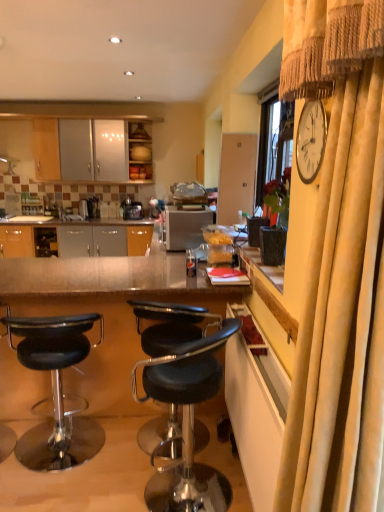
Question: Considering the relative sizes of velvet beige curtain at right and satin black coffee machine at center, placed as the 1th coffee machine when sorted from left to right, in the image provided, is velvet beige curtain at right thinner than satin black coffee machine at center, placed as the 1th coffee machine when sorted from left to right,?

Choices:
 (A) yes
 (B) no

Answer: (B)

Question: Does velvet beige curtain at right appear on the right side of satin black coffee machine at center, placed as the second coffee machine when sorted from right to left?

Choices:
 (A) yes
 (B) no

Answer: (A)

Question: Is velvet beige curtain at right located outside satin black coffee machine at center, placed as the 1th coffee machine when sorted from left to right?

Choices:
 (A) no
 (B) yes

Answer: (B)

Question: Is velvet beige curtain at right bigger than satin black coffee machine at center, placed as the 1th coffee machine when sorted from left to right?

Choices:
 (A) no
 (B) yes

Answer: (B)

Question: Is the depth of velvet beige curtain at right less than that of satin black coffee machine at center, placed as the second coffee machine when sorted from right to left?

Choices:
 (A) yes
 (B) no

Answer: (A)

Question: Looking at their shapes, would you say metallic/reflective table at center is wider or thinner than black leather stool at lower right, the 1th chair viewed from the right?

Choices:
 (A) wide
 (B) thin

Answer: (A)

Question: Is point (66, 259) positioned closer to the camera than point (201, 510)?

Choices:
 (A) farther
 (B) closer

Answer: (A)

Question: From a real-world perspective, is metallic/reflective table at center above or below black leather stool at lower right, the 1th chair viewed from the right?

Choices:
 (A) below
 (B) above

Answer: (B)

Question: Do you think metallic/reflective table at center is within black leather stool at lower right, marked as the second chair in a left-to-right arrangement, or outside of it?

Choices:
 (A) inside
 (B) outside

Answer: (B)

Question: Is satin silver toaster at center inside or outside of yellow wood cabinet at right, positioned as the 1th cabinetry in bottom-to-top order?

Choices:
 (A) outside
 (B) inside

Answer: (A)

Question: From a real-world perspective, is satin silver toaster at center physically located above or below yellow wood cabinet at right, positioned as the 1th cabinetry in bottom-to-top order?

Choices:
 (A) above
 (B) below

Answer: (A)

Question: Considering their positions, is satin silver toaster at center located in front of or behind yellow wood cabinet at right, the 2th cabinetry viewed from the left?

Choices:
 (A) behind
 (B) front

Answer: (A)

Question: In terms of width, does satin silver toaster at center look wider or thinner when compared to yellow wood cabinet at right, the 2th cabinetry viewed from the left?

Choices:
 (A) thin
 (B) wide

Answer: (B)

Question: From the image's perspective, relative to velvet beige curtain at right, is wooden cabinet at upper center, marked as the first cabinetry in a back-to-front arrangement, above or below?

Choices:
 (A) above
 (B) below

Answer: (A)

Question: From a real-world perspective, is wooden cabinet at upper center, marked as the first cabinetry in a back-to-front arrangement, above or below velvet beige curtain at right?

Choices:
 (A) above
 (B) below

Answer: (A)